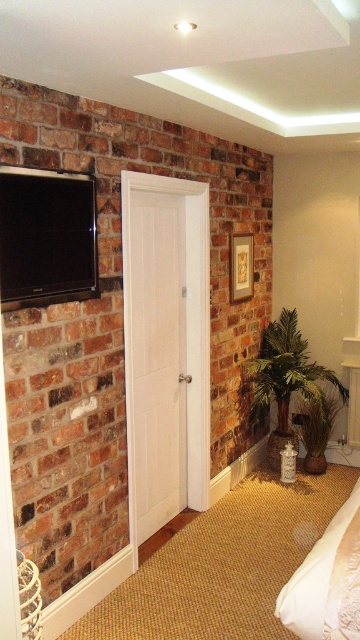
You are standing in the room and want to hang a new picture exactly to the right of the matte black flat screen tv at upper left. Based on its current position, where should you place the new picture?

The matte black flat screen tv at upper left is located at point [47,236], so you should place the new picture to the right of this coordinate.